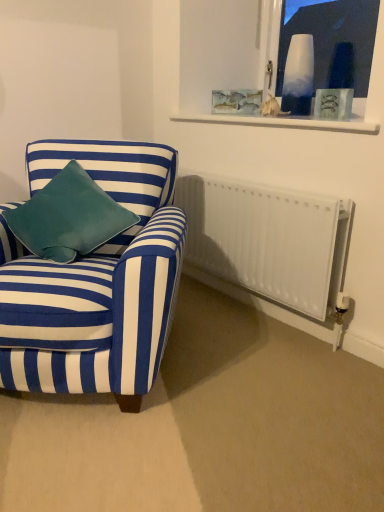
Question: Looking at their shapes, would you say white glass vase at upper right is wider or thinner than clear glass frame at upper center?

Choices:
 (A) thin
 (B) wide

Answer: (B)

Question: Is white glass vase at upper right inside or outside of clear glass frame at upper center?

Choices:
 (A) inside
 (B) outside

Answer: (B)

Question: Based on their relative distances, which object is nearer to the clear glass frame at upper center?

Choices:
 (A) velvet teal pillow at left
 (B) white matte radiator at lower right
 (C) white glass vase at upper right
 (D) blue striped fabric armchair at left

Answer: (B)

Question: Considering the real-world distances, which object is closest to the white glass vase at upper right?

Choices:
 (A) white matte radiator at lower right
 (B) blue striped fabric armchair at left
 (C) clear glass frame at upper center
 (D) velvet teal pillow at left

Answer: (C)